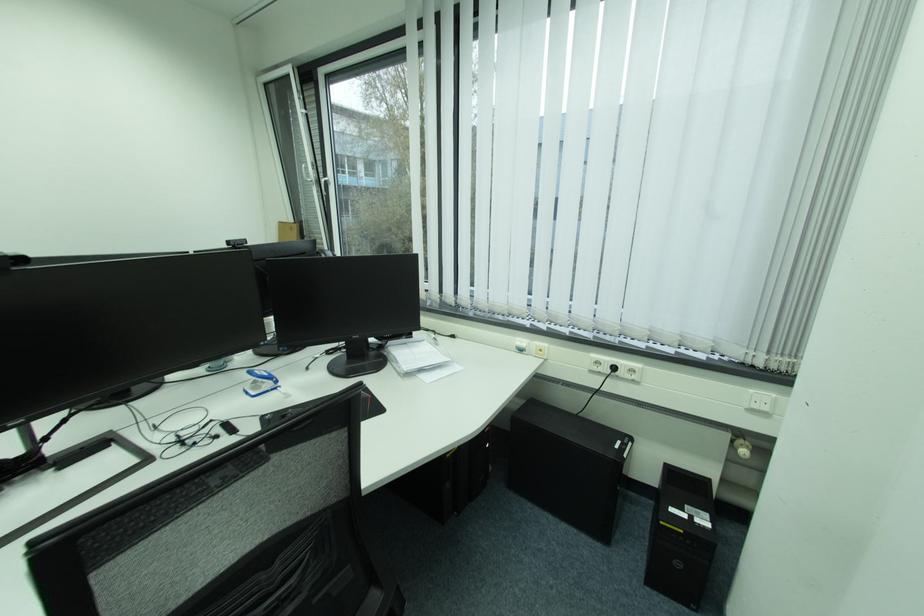
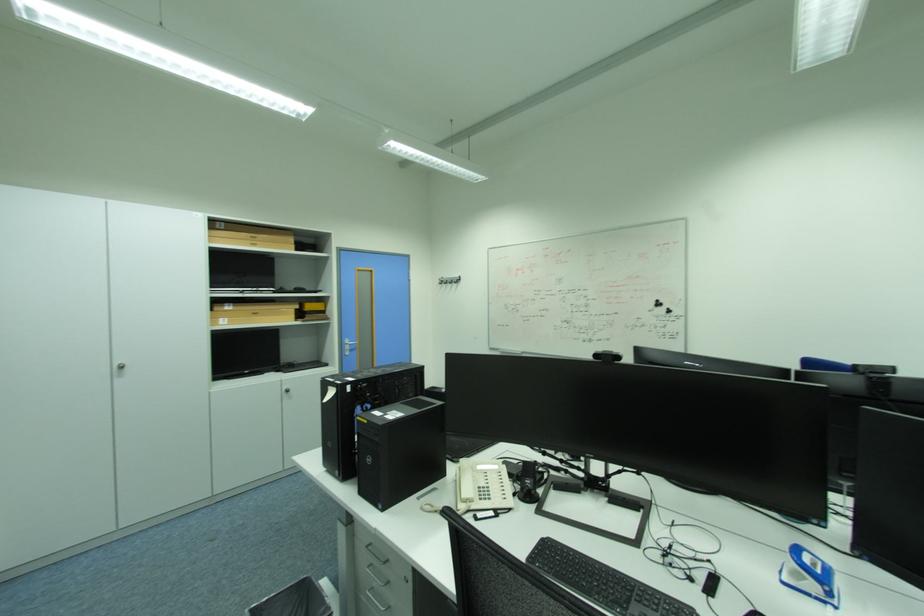
Question: The images are taken continuously from a first-person perspective. In which direction is your viewpoint rotating?

Choices:
 (A) Left
 (B) Right
 (C) Up
 (D) Down

Answer: (A)